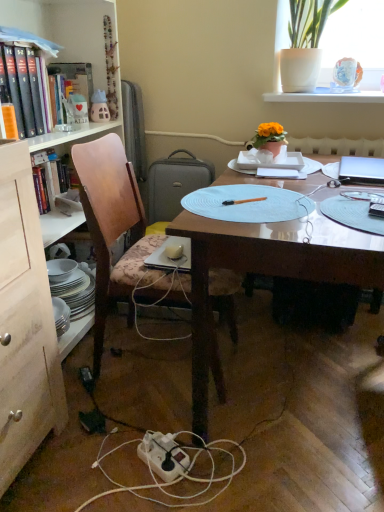
Find the location of a particular element. vacant space underneath wooden chair at left (from a real-world perspective) is located at coordinates (157, 365).